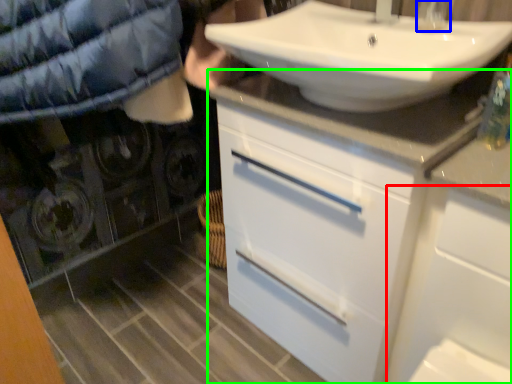
Question: Based on their relative distances, which object is nearer to cabinetry (highlighted by a red box)? Choose from faucet (highlighted by a blue box) and bathroom cabinet (highlighted by a green box).

Choices:
 (A) faucet
 (B) bathroom cabinet

Answer: (B)